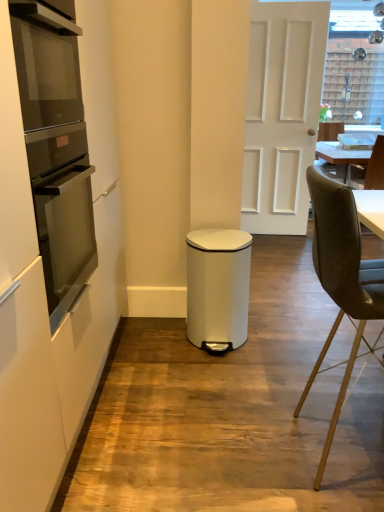
At what (x,y) coordinates should I click in order to perform the action: click on free space to the left of white matte waste bin at center. Please return your answer as a coordinate pair (x, y). This screenshot has height=512, width=384. Looking at the image, I should click on (163, 341).